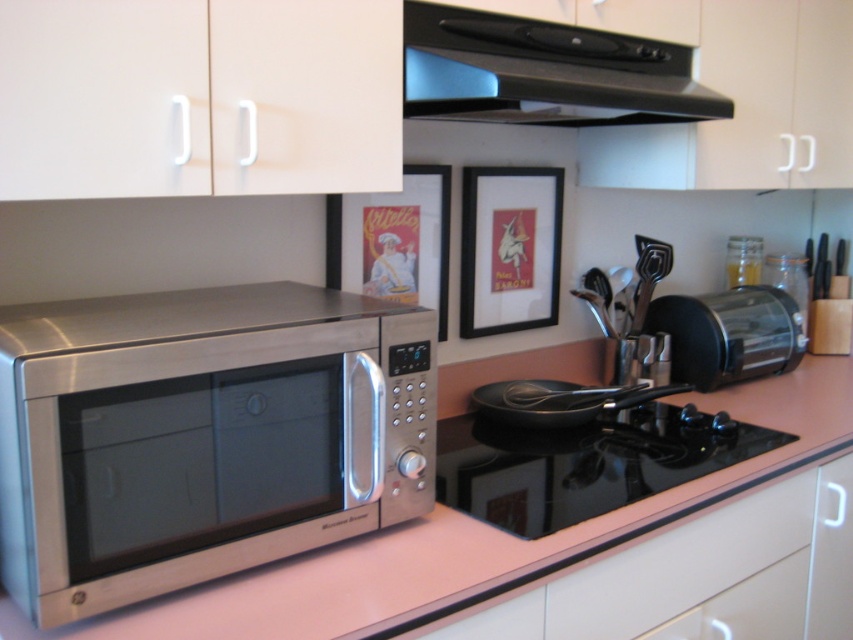
In the scene shown: You are standing in the kitchen and want to place a hot pot on the black glass cooktop at center. However, there is a metallic poster at upper center above it. Should you be concerned about the poster catching fire from the heat?

The black glass cooktop at center is closer to the viewer than the metallic poster at upper center, so the distance between them may not be sufficient to prevent the poster from overheating. Exercise caution to avoid potential fire hazards.

You are standing in the kitchen and want to place a small bowl on the counter between the microwave and the stovetop. The microwave is on the left, and the stovetop is on the right. You have two points marked on the counter where you can place the bowl. The first point is at coordinates point (x=610, y=464), and the second is at point (x=347, y=288). Which point is closer to the stovetop?

Point (x=610, y=464) is in front of point (x=347, y=288), so it is closer to the stovetop.